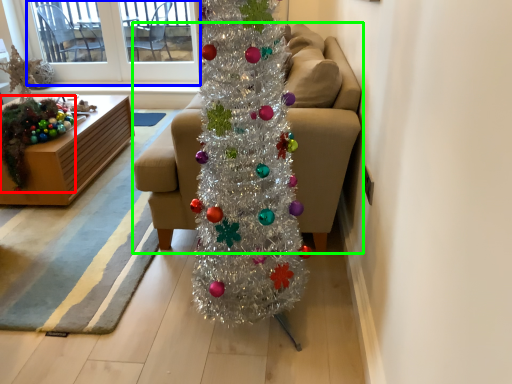
Question: Which is farther away from christmas decoration (highlighted by a red box)? window screen (highlighted by a blue box) or studio couch (highlighted by a green box)?

Choices:
 (A) window screen
 (B) studio couch

Answer: (A)